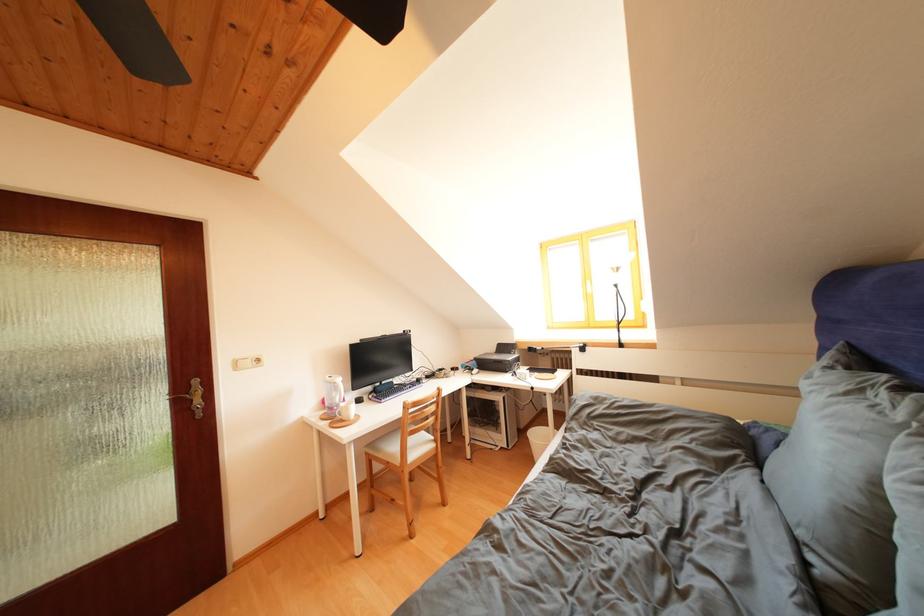
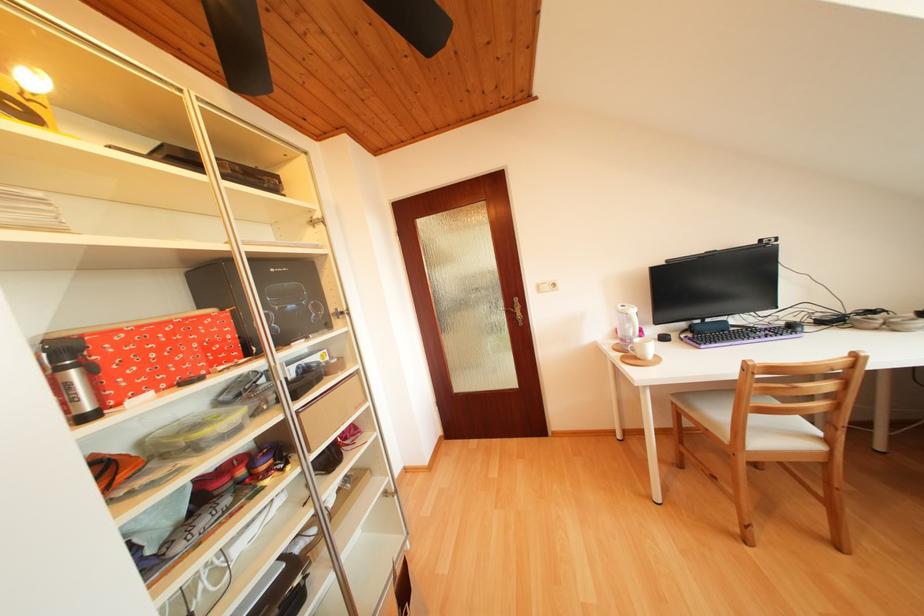
The point at (342,399) is marked in the first image. Where is the corresponding point in the second image?

(636, 331)